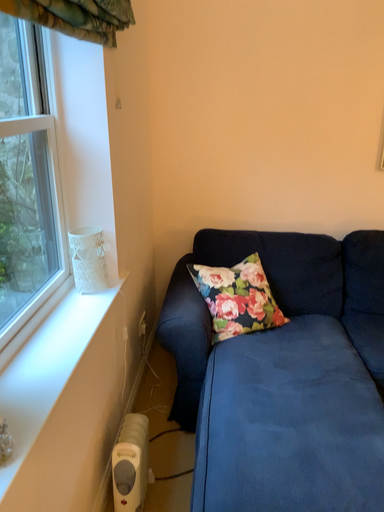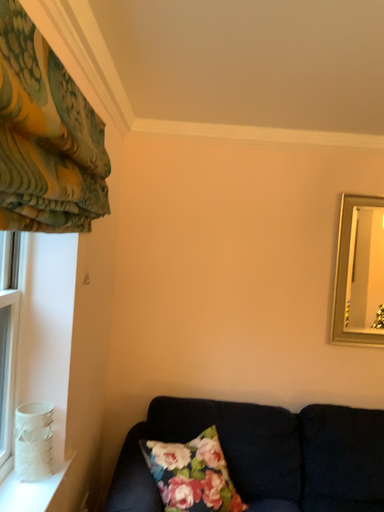
Question: How did the camera likely rotate when shooting the video?

Choices:
 (A) rotated downward
 (B) rotated upward

Answer: (B)